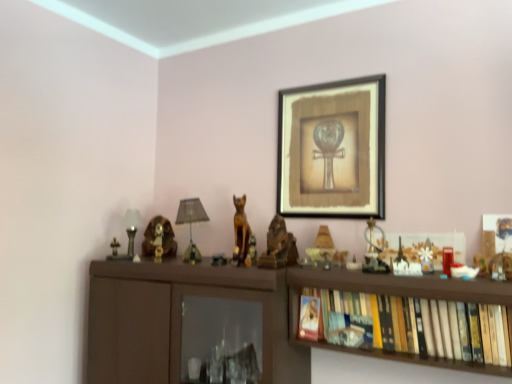
Where is `wooden picture frame at upper center`? wooden picture frame at upper center is located at coordinates (332, 149).

Describe the element at coordinates (132, 229) in the screenshot. I see `matte silver table lamp at left, which is counted as the 1th table lamp, starting from the left` at that location.

What do you see at coordinates (163, 238) in the screenshot?
I see `matte brown dog at left, which is counted as the 1th animal, starting from the back` at bounding box center [163, 238].

The image size is (512, 384). Describe the element at coordinates (309, 317) in the screenshot. I see `matte paper book at lower right, the first book in the left-to-right sequence` at that location.

Locate an element on the screen. The height and width of the screenshot is (384, 512). wooden picture frame at upper center is located at coordinates (332, 149).

Which is more to the right, metallic gold statue at center, the second toy viewed from the left, or wooden statue at center, marked as the first animal in a front-to-back arrangement?

From the viewer's perspective, wooden statue at center, marked as the first animal in a front-to-back arrangement, appears more on the right side.

From a real-world perspective, is metallic gold statue at center, the second toy viewed from the left, physically below wooden statue at center, which appears as the 3th animal when viewed from the left?

Indeed, from a real-world perspective, metallic gold statue at center, the second toy viewed from the left, is positioned beneath wooden statue at center, which appears as the 3th animal when viewed from the left.

Is metallic gold statue at center, the second toy viewed from the left, situated inside wooden statue at center, positioned as the third animal in back-to-front order, or outside?

metallic gold statue at center, the second toy viewed from the left, is outside wooden statue at center, positioned as the third animal in back-to-front order.

Which is in front, point (170, 231) or point (317, 100)?

The point (317, 100) is in front.

From a real-world perspective, is matte brown dog at left, marked as the 3th animal in a front-to-back arrangement, over wooden picture frame at upper center?

No, from a real-world perspective, matte brown dog at left, marked as the 3th animal in a front-to-back arrangement, is not over wooden picture frame at upper center

Considering the relative sizes of matte gold lamp at center-right, which ranks as the 3th toy in front-to-back order, and wooden statue at center, positioned as the third animal in back-to-front order, in the image provided, is matte gold lamp at center-right, which ranks as the 3th toy in front-to-back order, smaller than wooden statue at center, positioned as the third animal in back-to-front order,?

Yes, matte gold lamp at center-right, which ranks as the 3th toy in front-to-back order, is smaller than wooden statue at center, positioned as the third animal in back-to-front order.

From the image's perspective, which is above, matte gold lamp at center-right, which is the 3th toy from right to left, or wooden statue at center, marked as the first animal in a front-to-back arrangement?

wooden statue at center, marked as the first animal in a front-to-back arrangement, from the image's perspective.

How far apart are matte gold lamp at center-right, which is the 3th toy from right to left, and wooden statue at center, which appears as the 3th animal when viewed from the left?

The distance of matte gold lamp at center-right, which is the 3th toy from right to left, from wooden statue at center, which appears as the 3th animal when viewed from the left, is 5.18 inches.

Which is in front, point (330, 248) or point (259, 260)?

The point (259, 260) is more forward.

I want to click on the 1st table lamp positioned above the matte paper book at lower right, which is the 2th book in right-to-left order (from a real-world perspective), so click(132, 229).

Is matte paper book at lower right, arranged as the first book when viewed from the back, not close to matte silver table lamp at left, which is counted as the 1th table lamp, starting from the left?

Actually, matte paper book at lower right, arranged as the first book when viewed from the back, and matte silver table lamp at left, which is counted as the 1th table lamp, starting from the left, are a little close together.

From the image's perspective, which one is positioned higher, matte paper book at lower right, acting as the 2th book starting from the front, or matte silver table lamp at left, which appears as the 2th table lamp when viewed from the right?

matte silver table lamp at left, which appears as the 2th table lamp when viewed from the right, appears higher in the image.

Is matte silver table lamp at left, which appears as the 2th table lamp when viewed from the right, surrounded by matte paper book at lower right, which is the 2th book in right-to-left order?

No, matte silver table lamp at left, which appears as the 2th table lamp when viewed from the right, is not surrounded by matte paper book at lower right, which is the 2th book in right-to-left order.

Which object is positioned more to the right, hardcover books at right, which appears as the 2th book when viewed from the back, or wooden picture frame at upper center?

From the viewer's perspective, hardcover books at right, which appears as the 2th book when viewed from the back, appears more on the right side.

Locate an element on the screen. picture frame to the left of hardcover books at right, arranged as the first book when viewed from the front is located at coordinates (332, 149).

From the image's perspective, which object appears higher, hardcover books at right, which is the 1th book from right to left, or wooden picture frame at upper center?

wooden picture frame at upper center.

Does matte paper book at lower right, the first book in the left-to-right sequence, have a larger size compared to metallic gold clock at center-right, which ranks as the second toy in right-to-left order?

Actually, matte paper book at lower right, the first book in the left-to-right sequence, might be smaller than metallic gold clock at center-right, which ranks as the second toy in right-to-left order.

Can you confirm if matte paper book at lower right, the first book in the left-to-right sequence, is positioned to the left of metallic gold clock at center-right, the fourth toy from the back?

Correct, you'll find matte paper book at lower right, the first book in the left-to-right sequence, to the left of metallic gold clock at center-right, the fourth toy from the back.

From a real-world perspective, between matte paper book at lower right, the first book in the left-to-right sequence, and metallic gold clock at center-right, which ranks as the second toy in right-to-left order, who is vertically higher?

metallic gold clock at center-right, which ranks as the second toy in right-to-left order, from a real-world perspective.

Is matte paper book at lower right, acting as the 2th book starting from the front, beside metallic gold clock at center-right, the fourth toy from the back?

No, matte paper book at lower right, acting as the 2th book starting from the front, is not making contact with metallic gold clock at center-right, the fourth toy from the back.

Is white matte star at upper right, the first toy positioned from the front, not inside matte brown dog at left, marked as the 3th animal in a front-to-back arrangement?

white matte star at upper right, the first toy positioned from the front, is positioned outside matte brown dog at left, marked as the 3th animal in a front-to-back arrangement.

From a real-world perspective, is white matte star at upper right, positioned as the 1th toy in right-to-left order, on matte brown dog at left, which appears as the third animal when viewed from the right?

No.

Considering the relative positions of white matte star at upper right, the fifth toy viewed from the left, and matte brown dog at left, marked as the 3th animal in a front-to-back arrangement, in the image provided, is white matte star at upper right, the fifth toy viewed from the left, to the right of matte brown dog at left, marked as the 3th animal in a front-to-back arrangement, from the viewer's perspective?

Yes.

Locate an element on the screen. The image size is (512, 384). toy that is the 3rd one when counting backward from the wooden statue at center, the first animal when ordered from right to left is located at coordinates (251, 251).

Locate an element on the screen. The height and width of the screenshot is (384, 512). the 3rd animal below the wooden picture frame at upper center (from the image's perspective) is located at coordinates (163, 238).

Looking at the image, which one is located further to metallic gold statue at center, which appears as the second toy when viewed from the back, hardcover books at right, arranged as the first book when viewed from the front, or matte gold lamp at center-right, which ranks as the 3th toy in front-to-back order?

A: The object further to metallic gold statue at center, which appears as the second toy when viewed from the back, is hardcover books at right, arranged as the first book when viewed from the front.

From the image, which object appears to be nearer to matte paper book at lower right, arranged as the first book when viewed from the back, matte black table lamp at center, the 2th table lamp when ordered from left to right, or matte gold lamp at center-right, which ranks as the 3th toy in front-to-back order?

matte gold lamp at center-right, which ranks as the 3th toy in front-to-back order, lies closer to matte paper book at lower right, arranged as the first book when viewed from the back, than the other object.

Looking at the image, which one is located closer to white matte star at upper right, the first toy positioned from the front, metallic gold statue at center, which ranks as the 4th toy in right-to-left order, or matte black table lamp at center, the 2th table lamp when ordered from left to right?

Based on the image, metallic gold statue at center, which ranks as the 4th toy in right-to-left order, appears to be nearer to white matte star at upper right, the first toy positioned from the front.

Estimate the real-world distances between objects in this image. Which object is further from metallic gold clock at center-right, the fourth toy from the back, wooden statue at center, which appears as the 3th animal when viewed from the left, or white matte star at upper right, the 5th toy in the back-to-front sequence?

wooden statue at center, which appears as the 3th animal when viewed from the left, lies further to metallic gold clock at center-right, the fourth toy from the back, than the other object.

Considering their positions, is white matte star at upper right, the first toy positioned from the front, positioned further to wooden cat at center, which ranks as the second animal in right-to-left order, than wooden picture frame at upper center?

The object further to wooden cat at center, which ranks as the second animal in right-to-left order, is white matte star at upper right, the first toy positioned from the front.

Consider the image. Considering their positions, is matte paper book at lower right, which is the 2th book in right-to-left order, positioned closer to metallic gold figurine at left, marked as the first toy in a back-to-front arrangement, than hardcover books at right, the 2th book positioned from the left?

matte paper book at lower right, which is the 2th book in right-to-left order, is positioned closer to the anchor metallic gold figurine at left, marked as the first toy in a back-to-front arrangement.

Estimate the real-world distances between objects in this image. Which object is further from wooden statue at center, marked as the first animal in a front-to-back arrangement, metallic gold figurine at left, the first toy from the left, or matte gold lamp at center-right, which is the 3th toy from right to left?

metallic gold figurine at left, the first toy from the left, is further to wooden statue at center, marked as the first animal in a front-to-back arrangement.

Which object lies nearer to the anchor point wooden statue at center, marked as the first animal in a front-to-back arrangement, wooden cat at center, which ranks as the second animal in right-to-left order, or matte brown dog at left, which is counted as the 1th animal, starting from the back?

wooden cat at center, which ranks as the second animal in right-to-left order, is closer to wooden statue at center, marked as the first animal in a front-to-back arrangement.

Identify the location of book situated between metallic gold figurine at left, the first toy from the left, and metallic gold clock at center-right, the fourth toy from the back, from left to right. This screenshot has height=384, width=512. (309, 317).

What are the coordinates of `animal between wooden picture frame at upper center and wooden statue at center, positioned as the third animal in back-to-front order, in the vertical direction` in the screenshot? It's located at (241, 232).

This screenshot has width=512, height=384. I want to click on animal between metallic gold statue at center, which appears as the second toy when viewed from the back, and metallic gold clock at center-right, the fourth toy from the back, from left to right, so click(x=279, y=246).

This screenshot has width=512, height=384. Identify the location of book between matte black table lamp at center, the 2th table lamp when ordered from left to right, and wooden picture frame at upper center from left to right. (309, 317).